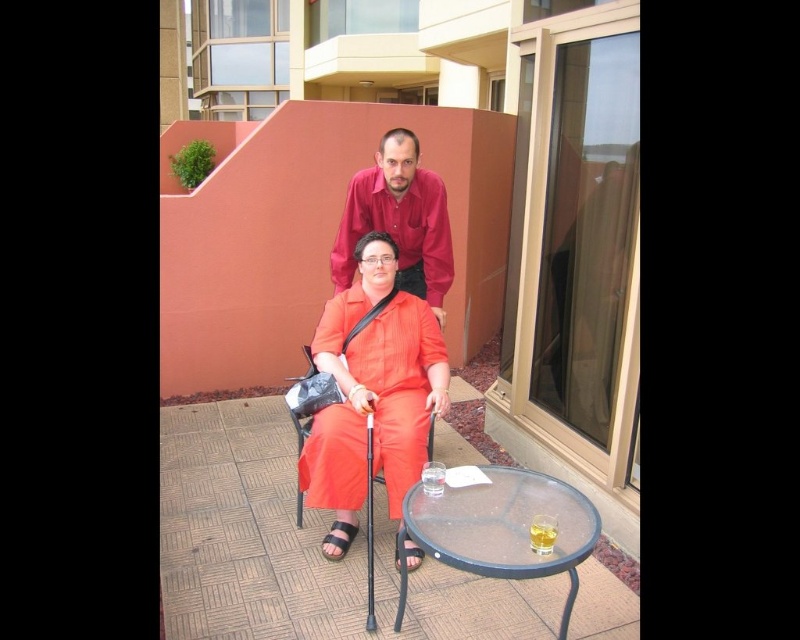
From the picture: Can you confirm if matte red shirt at upper center is positioned to the right of matte orange fabric chair at center?

Yes, matte red shirt at upper center is to the right of matte orange fabric chair at center.

Based on the photo, does matte red shirt at upper center appear over matte orange fabric chair at center?

Yes.

Is point (436, 218) positioned before point (308, 429)?

No, (436, 218) is behind (308, 429).

I want to click on matte red shirt at upper center, so click(398, 220).

The height and width of the screenshot is (640, 800). What do you see at coordinates (372, 394) in the screenshot?
I see `matte orange jumpsuit at center` at bounding box center [372, 394].

The width and height of the screenshot is (800, 640). I want to click on matte orange jumpsuit at center, so click(x=372, y=394).

Describe the element at coordinates (372, 394) in the screenshot. This screenshot has width=800, height=640. I see `matte orange jumpsuit at center` at that location.

Is matte orange jumpsuit at center positioned in front of matte red shirt at upper center?

Yes, matte orange jumpsuit at center is closer to the viewer.

Locate an element on the screen. The height and width of the screenshot is (640, 800). matte orange jumpsuit at center is located at coordinates (372, 394).